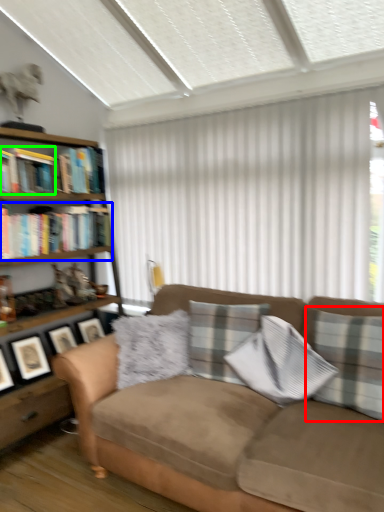
Question: Considering the real-world distances, which object is closest to pillow (highlighted by a red box)? book (highlighted by a blue box) or book (highlighted by a green box).

Choices:
 (A) book
 (B) book

Answer: (A)